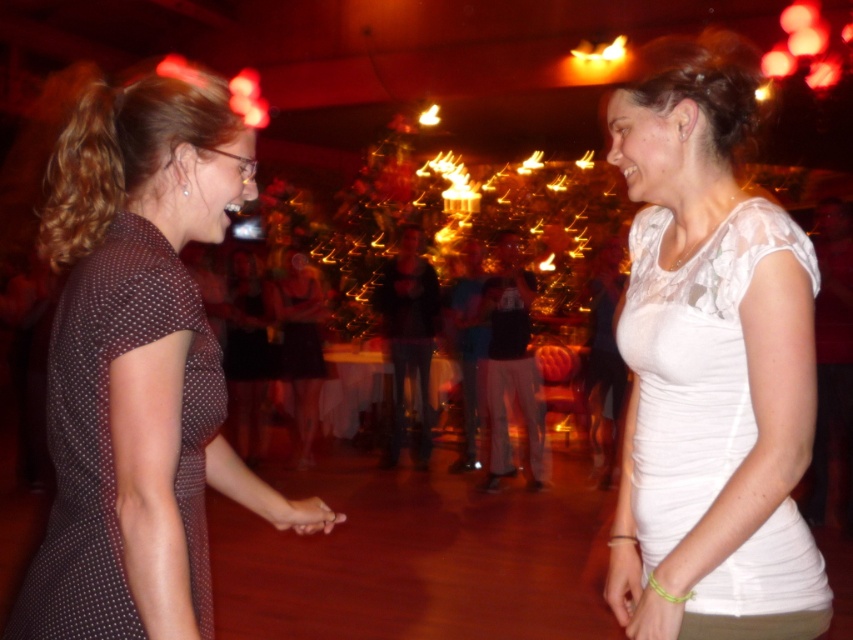
Question: Can you confirm if dark brown sheer dress at left is positioned below yellow rubber band at lower right?

Choices:
 (A) yes
 (B) no

Answer: (B)

Question: Does black mesh dress at center come in front of white matte wristband at lower right?

Choices:
 (A) no
 (B) yes

Answer: (A)

Question: Which object appears farthest from the camera in this image?

Choices:
 (A) pink matte hand at center
 (B) black mesh dress at center
 (C) white sheer blouse at center

Answer: (B)

Question: Which point appears closest to the camera in this image?

Choices:
 (A) (755, 611)
 (B) (108, 483)
 (C) (318, 502)
 (D) (320, 371)

Answer: (B)

Question: Observing the image, what is the correct spatial positioning of dark brown dress at center in reference to pink matte hand at center?

Choices:
 (A) above
 (B) below

Answer: (A)

Question: Which point is closer to the camera taking this photo?

Choices:
 (A) (697, 500)
 (B) (288, 502)
 (C) (96, 612)

Answer: (C)